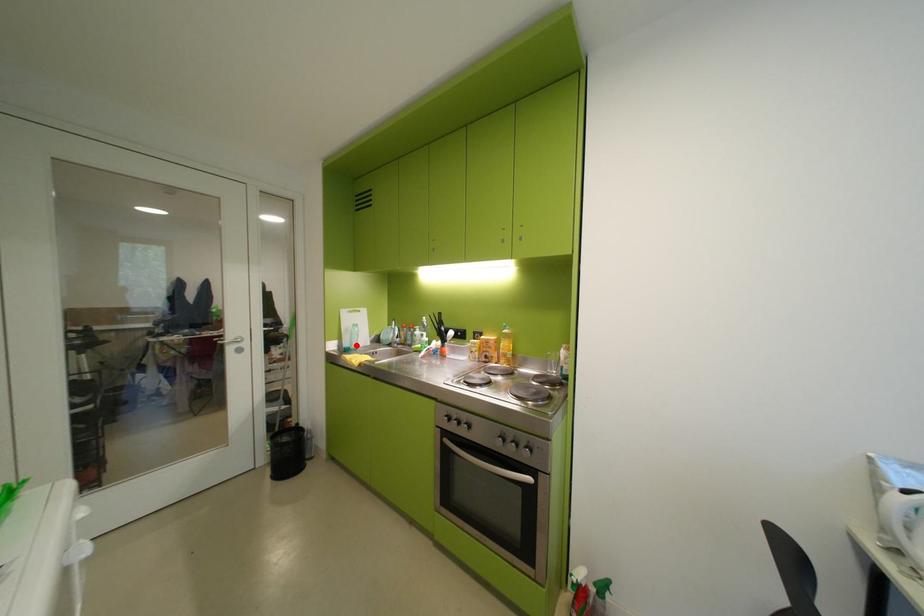
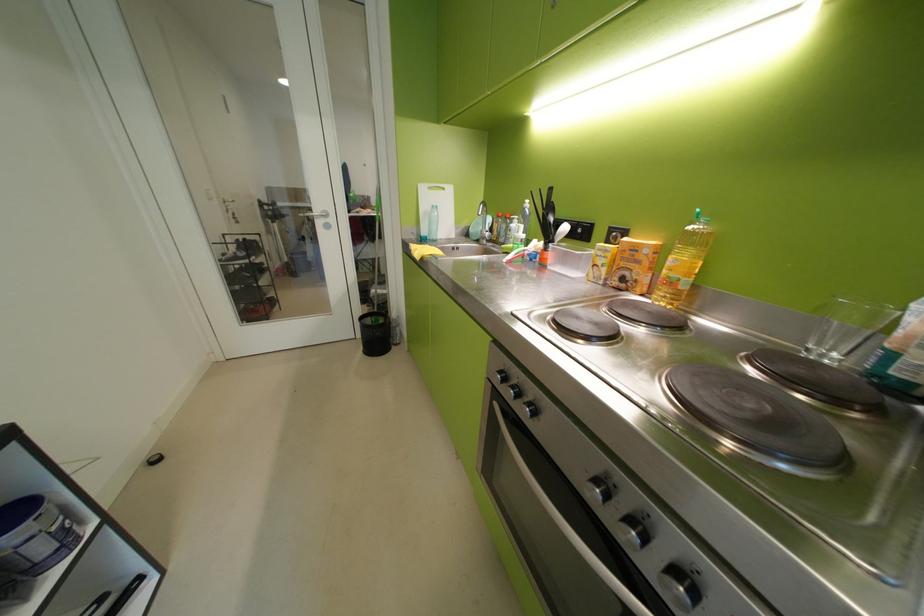
Find the pixel in the second image that matches the highlighted location in the first image.

(433, 233)